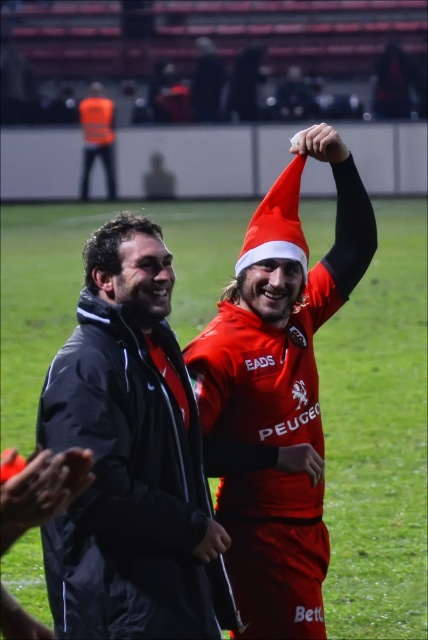
Question: Is orange reflective vest at upper left to the right of matte red jersey at center from the viewer's perspective?

Choices:
 (A) yes
 (B) no

Answer: (B)

Question: Among these points, which one is nearest to the camera?

Choices:
 (A) (199, 508)
 (B) (351, 168)

Answer: (A)

Question: Does red matte santa hat at center have a lesser width compared to matte black arm at upper center?

Choices:
 (A) yes
 (B) no

Answer: (B)

Question: Does black matte jacket at center appear on the left side of matte black hand at center?

Choices:
 (A) yes
 (B) no

Answer: (A)

Question: Estimate the real-world distances between objects in this image. Which object is closer to the black matte jacket at center?

Choices:
 (A) red matte santa hat at center
 (B) green grass football field at center

Answer: (A)

Question: Which of these objects is positioned closest to the dark gray jacket at left?

Choices:
 (A) matte red santa hat at upper center
 (B) matte black arm at upper center
 (C) green grass football field at center
 (D) orange reflective vest at upper left

Answer: (B)